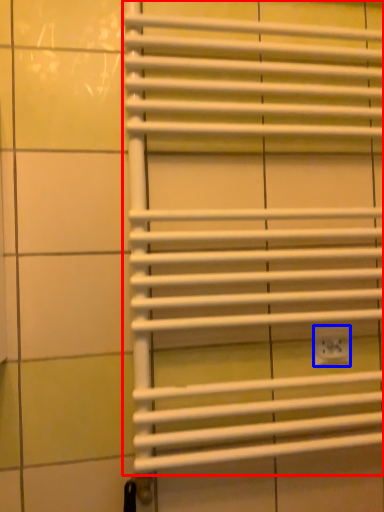
Question: Among these objects, which one is nearest to the camera, window blind (highlighted by a red box) or electric outlet (highlighted by a blue box)?

Choices:
 (A) window blind
 (B) electric outlet

Answer: (A)